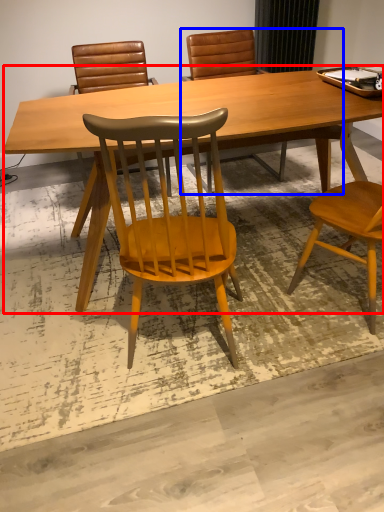
Question: Among these objects, which one is nearest to the camera, desk (highlighted by a red box) or chair (highlighted by a blue box)?

Choices:
 (A) desk
 (B) chair

Answer: (A)